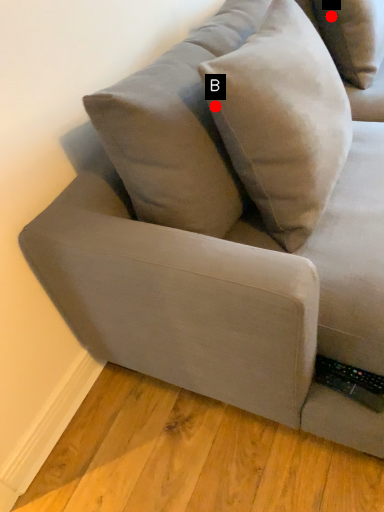
Question: Two points are circled on the image, labeled by A and B beside each circle. Among these points, which one is farthest from the camera?

Choices:
 (A) A is further
 (B) B is further

Answer: (A)